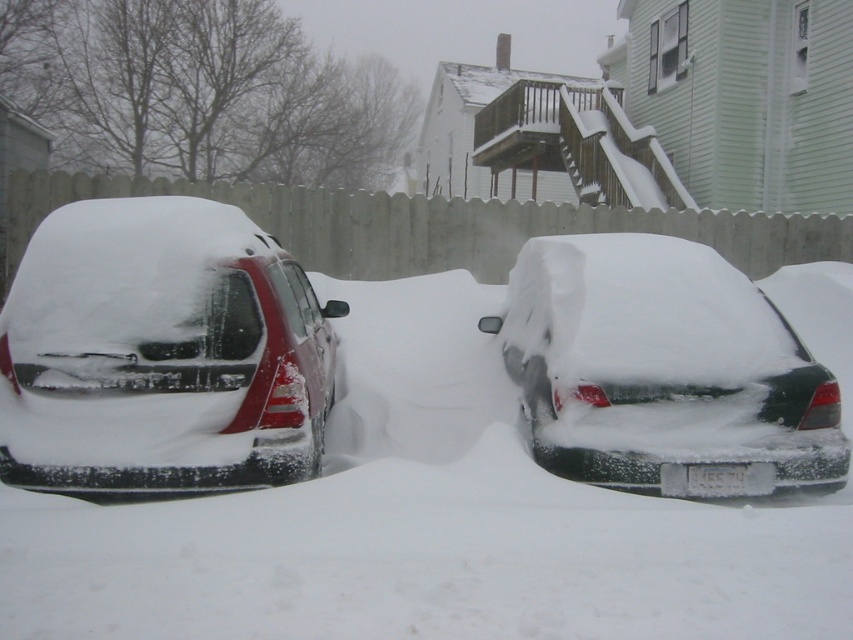
Who is shorter, white matte car at center or sleek matte red car at left?

Standing shorter between the two is white matte car at center.

Measure the distance between white matte car at center and camera.

The distance of white matte car at center from camera is 9.91 feet.

At what (x,y) coordinates should I click in order to perform the action: click on white matte car at center. Please return your answer as a coordinate pair (x, y). Looking at the image, I should click on (425, 524).

Does white matte car at center have a greater width compared to snow-covered sedan at center?

Incorrect, white matte car at center's width does not surpass snow-covered sedan at center's.

Is white matte car at center taller than snow-covered sedan at center?

Incorrect, white matte car at center's height is not larger of snow-covered sedan at center's.

What do you see at coordinates (425, 524) in the screenshot? I see `white matte car at center` at bounding box center [425, 524].

Where is `white matte car at center`? white matte car at center is located at coordinates click(x=425, y=524).

Is sleek matte red car at left shorter than snow-covered sedan at center?

Yes.

Can you confirm if sleek matte red car at left is wider than snow-covered sedan at center?

No, sleek matte red car at left is not wider than snow-covered sedan at center.

Between point (112, 467) and point (669, 298), which one is positioned in front?

Point (112, 467) is in front.

Where is `sleek matte red car at left`? sleek matte red car at left is located at coordinates (161, 353).